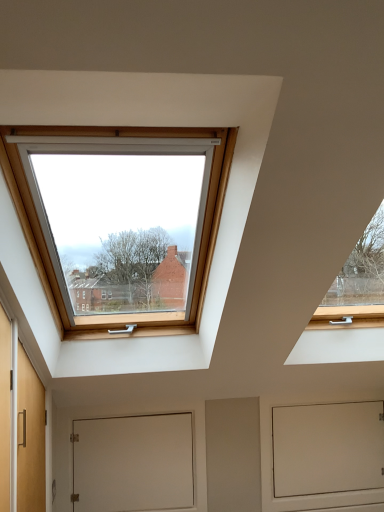
Question: Is white matte door at center shorter than white matte screen door at lower center?

Choices:
 (A) yes
 (B) no

Answer: (A)

Question: From the image's perspective, does white matte door at center appear higher than white matte screen door at lower center?

Choices:
 (A) yes
 (B) no

Answer: (A)

Question: Considering the relative sizes of white matte door at center and white matte screen door at lower center in the image provided, is white matte door at center wider than white matte screen door at lower center?

Choices:
 (A) yes
 (B) no

Answer: (B)

Question: Is white matte door at center positioned beyond the bounds of white matte screen door at lower center?

Choices:
 (A) no
 (B) yes

Answer: (B)

Question: Considering the relative sizes of white matte door at center and white matte screen door at lower center in the image provided, is white matte door at center thinner than white matte screen door at lower center?

Choices:
 (A) no
 (B) yes

Answer: (B)

Question: Does white matte door at center touch white matte screen door at lower center?

Choices:
 (A) yes
 (B) no

Answer: (B)

Question: Is white matte screen door at lower center facing towards white matte door at center?

Choices:
 (A) yes
 (B) no

Answer: (B)

Question: Does white matte screen door at lower center come behind white matte door at center?

Choices:
 (A) yes
 (B) no

Answer: (A)

Question: Does white matte screen door at lower center lie in front of white matte door at center?

Choices:
 (A) yes
 (B) no

Answer: (B)

Question: Is white matte screen door at lower center facing away from white matte door at center?

Choices:
 (A) no
 (B) yes

Answer: (A)

Question: Does white matte screen door at lower center appear on the left side of white matte door at center?

Choices:
 (A) no
 (B) yes

Answer: (A)

Question: Does white matte screen door at lower center have a larger size compared to white matte door at center?

Choices:
 (A) no
 (B) yes

Answer: (B)

Question: Is white matte door at center situated inside white matte screen door at lower center or outside?

Choices:
 (A) inside
 (B) outside

Answer: (B)